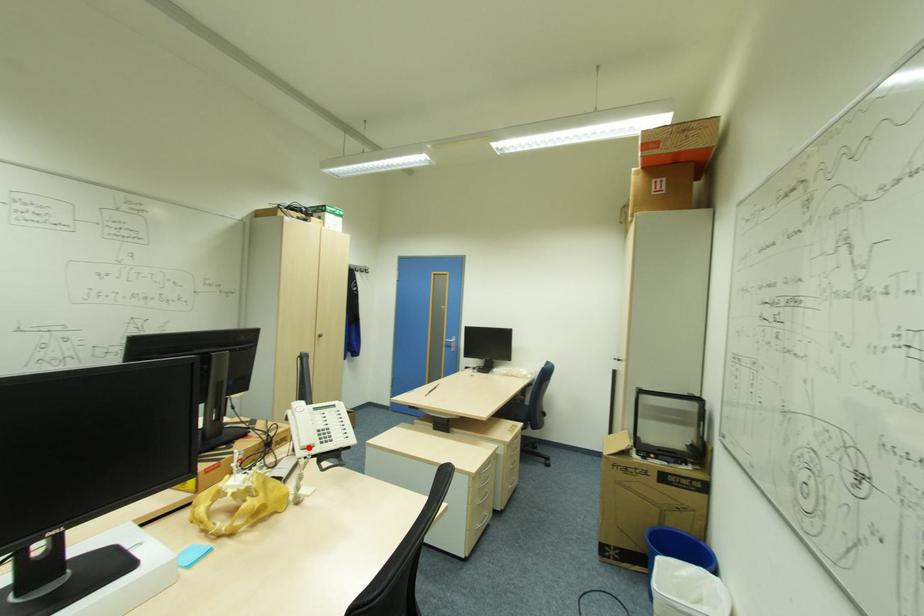
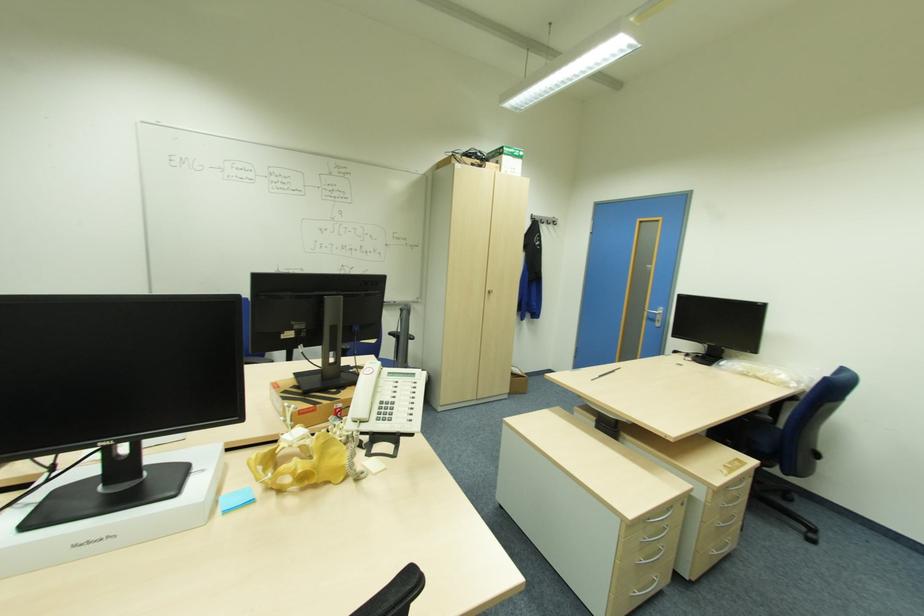
Locate, in the second image, the point that corresponds to the highlighted location in the first image.

(359, 422)